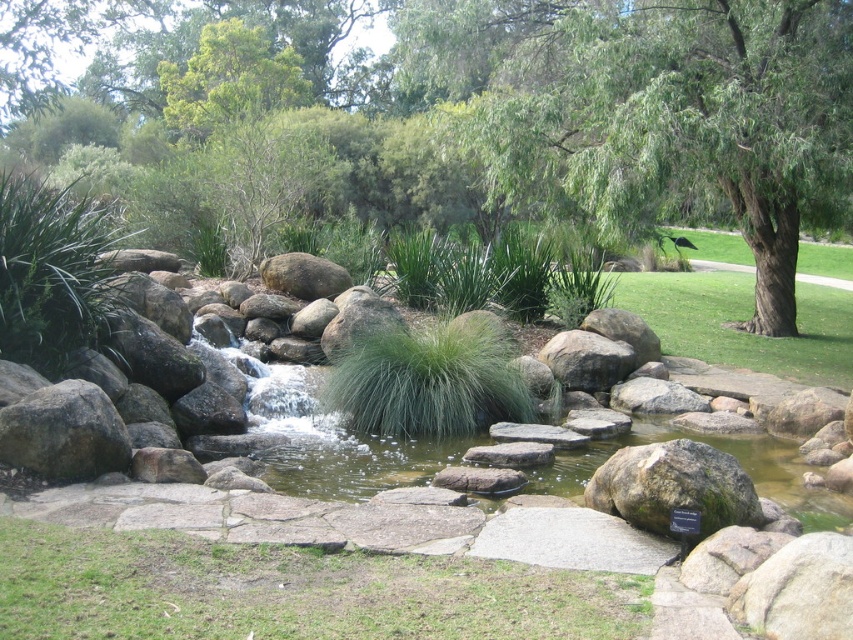
Question: Which point is closer to the camera?

Choices:
 (A) (286, 67)
 (B) (276, 269)
 (C) (477, 458)
 (D) (230, 76)

Answer: (C)

Question: Does green mossy rock at lower right come behind gray rough rock at left?

Choices:
 (A) no
 (B) yes

Answer: (A)

Question: Estimate the real-world distances between objects in this image. Which object is farther from the green grass at center?

Choices:
 (A) green leafy tree at upper center
 (B) rustic brown rock at center
 (C) green fuzzy grass at center
 (D) green leafy tree at center

Answer: (A)

Question: Among these objects, which one is farthest from the camera?

Choices:
 (A) rough textured rock at center
 (B) green leafy tree at center
 (C) rustic brown rock at center

Answer: (C)

Question: Is the position of green grass at lower center less distant than that of smooth gray rock at center?

Choices:
 (A) no
 (B) yes

Answer: (B)

Question: Is the position of green leafy tree at center more distant than that of rustic brown rock at center?

Choices:
 (A) no
 (B) yes

Answer: (A)